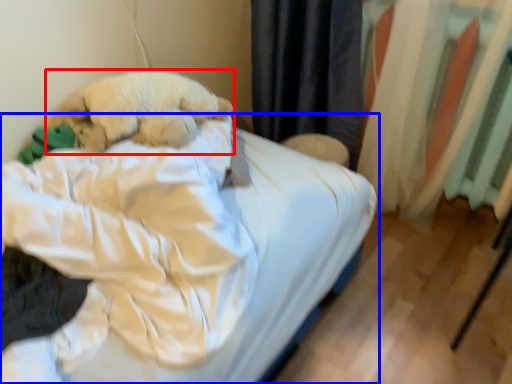
Question: Which of the following is the farthest to the observer, dog (highlighted by a red box) or bed (highlighted by a blue box)?

Choices:
 (A) dog
 (B) bed

Answer: (A)